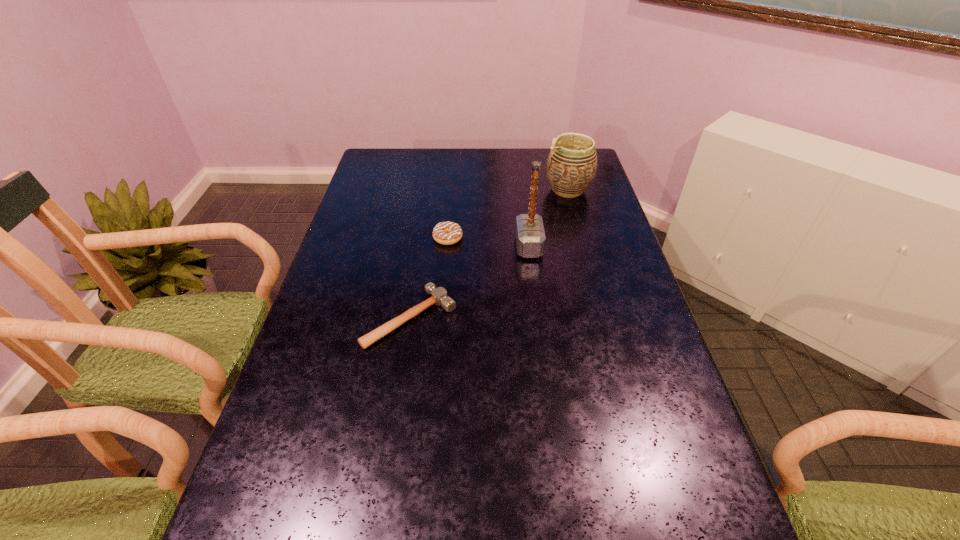
This screenshot has height=540, width=960. Identify the location of vacant area that lies between the rightmost object and the doughnut. (508, 214).

Image resolution: width=960 pixels, height=540 pixels. Find the location of `the second closest object to the left hammer`. the second closest object to the left hammer is located at coordinates (530, 236).

Locate an element on the screen. The width and height of the screenshot is (960, 540). the second closest object to the nearest object is located at coordinates (530, 236).

Locate an element on the screen. This screenshot has height=540, width=960. vacant space that satisfies the following two spatial constraints: 1. on the back side of the doughnut; 2. on the left side of the shorter hammer is located at coordinates (422, 238).